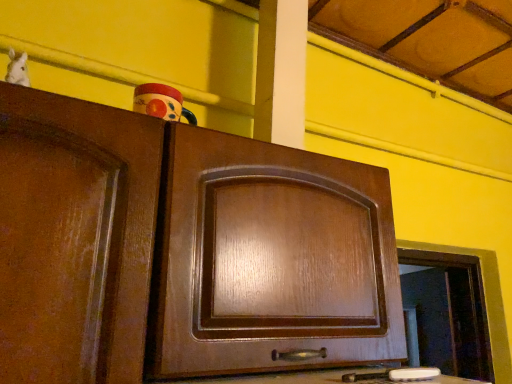
Where is `wooden cabinet at center`? The width and height of the screenshot is (512, 384). wooden cabinet at center is located at coordinates (183, 250).

What do you see at coordinates (183, 250) in the screenshot? This screenshot has height=384, width=512. I see `wooden cabinet at center` at bounding box center [183, 250].

At what (x,y) coordinates should I click in order to perform the action: click on wooden cabinet at center. Please return your answer as a coordinate pair (x, y). Looking at the image, I should click on [x=183, y=250].